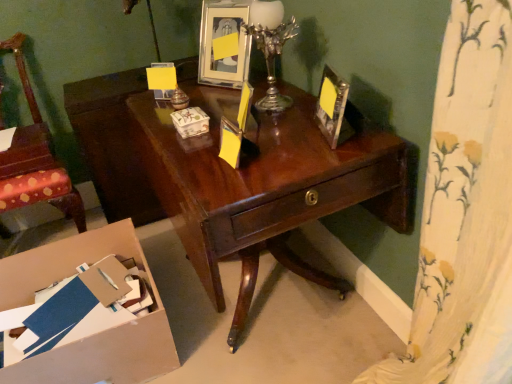
Question: Can you confirm if silver metallic candle holder at upper right is shorter than metallic silver picture frame at upper right, acting as the second picture frame starting from the top?

Choices:
 (A) yes
 (B) no

Answer: (B)

Question: Is silver metallic candle holder at upper right located outside metallic silver picture frame at upper right, arranged as the first picture frame when viewed from the right?

Choices:
 (A) yes
 (B) no

Answer: (A)

Question: From a real-world perspective, is silver metallic candle holder at upper right under metallic silver picture frame at upper right, the second picture frame positioned from the back?

Choices:
 (A) no
 (B) yes

Answer: (A)

Question: Can you confirm if silver metallic candle holder at upper right is taller than metallic silver picture frame at upper right, the second picture frame positioned from the back?

Choices:
 (A) yes
 (B) no

Answer: (A)

Question: Is silver metallic candle holder at upper right positioned far away from metallic silver picture frame at upper right, acting as the second picture frame starting from the top?

Choices:
 (A) yes
 (B) no

Answer: (B)

Question: Is silver metallic candle holder at upper right aimed at metallic silver picture frame at upper right, arranged as the first picture frame when viewed from the right?

Choices:
 (A) yes
 (B) no

Answer: (B)

Question: Can you confirm if cardboard box at lower left is bigger than shiny dark wood desk at center?

Choices:
 (A) yes
 (B) no

Answer: (B)

Question: Is cardboard box at lower left in front of shiny dark wood desk at center?

Choices:
 (A) no
 (B) yes

Answer: (A)

Question: Is cardboard box at lower left in contact with shiny dark wood desk at center?

Choices:
 (A) yes
 (B) no

Answer: (B)

Question: Is cardboard box at lower left to the right of shiny dark wood desk at center from the viewer's perspective?

Choices:
 (A) no
 (B) yes

Answer: (A)

Question: Is shiny dark wood desk at center completely or partially inside cardboard box at lower left?

Choices:
 (A) yes
 (B) no

Answer: (B)

Question: Is cardboard box at lower left oriented towards shiny dark wood desk at center?

Choices:
 (A) no
 (B) yes

Answer: (A)

Question: Can you confirm if wooden chair at left is wider than metallic silver picture frame at upper right, the 1th picture frame from the bottom?

Choices:
 (A) yes
 (B) no

Answer: (A)